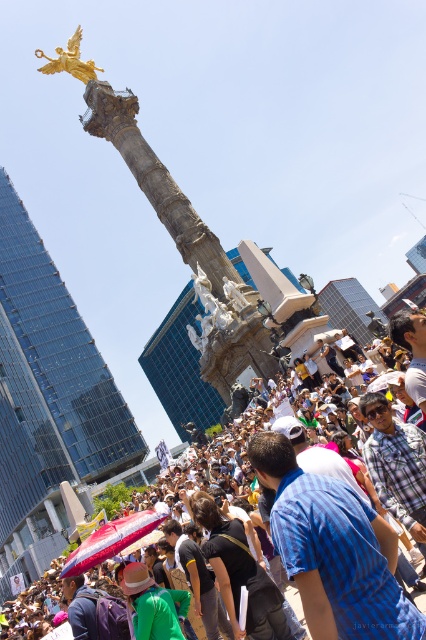
Question: Is blue plaid shirt at center thinner than gold polished statue at upper left?

Choices:
 (A) no
 (B) yes

Answer: (B)

Question: Does matte black crowd at center appear under gold polished statue at upper left?

Choices:
 (A) yes
 (B) no

Answer: (A)

Question: Which of the following is the farthest from the observer?

Choices:
 (A) matte black crowd at center
 (B) blue plaid shirt at center

Answer: (A)

Question: In this image, where is blue plaid shirt at center located relative to matte black crowd at center?

Choices:
 (A) below
 (B) above

Answer: (B)

Question: Estimate the real-world distances between objects in this image. Which object is closer to the blue plaid shirt at center?

Choices:
 (A) matte black crowd at center
 (B) gold polished statue at upper left

Answer: (A)

Question: Which point is closer to the camera?

Choices:
 (A) blue plaid shirt at center
 (B) gold polished statue at upper left

Answer: (A)